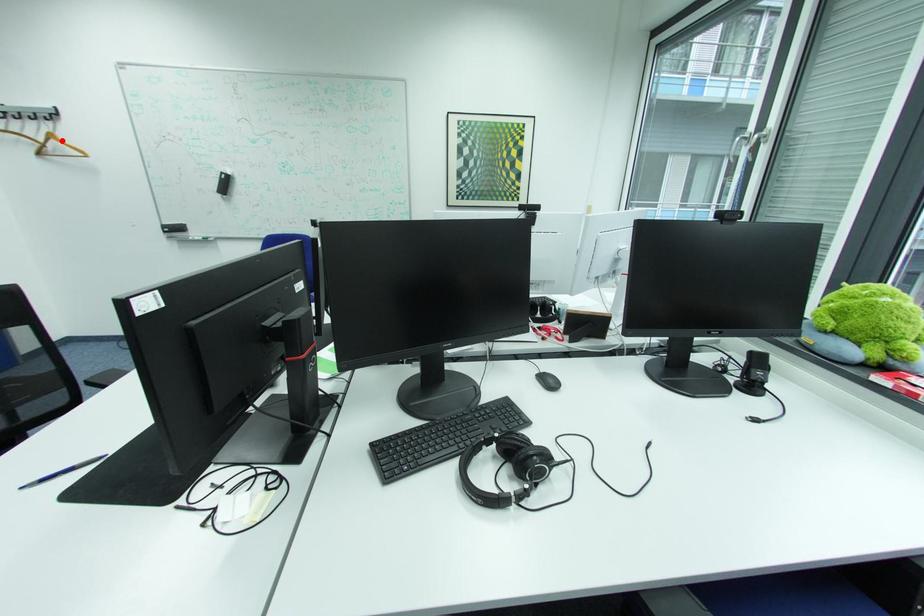
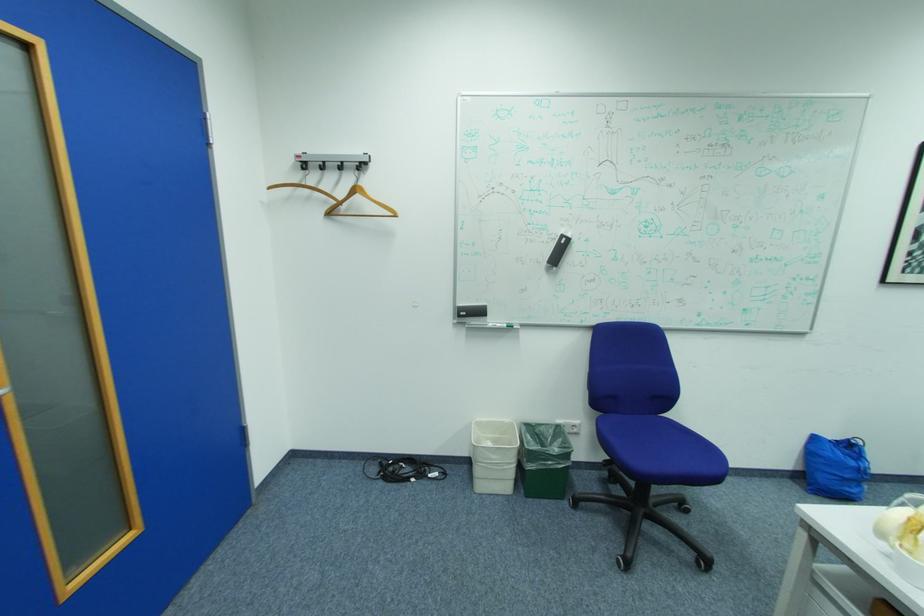
Question: I am providing you with two images of the same scene from different viewpoints. A red point is marked on the first image. At the location where the point appears in image 1, is it still visible in image 2?

Choices:
 (A) Yes
 (B) No

Answer: (A)